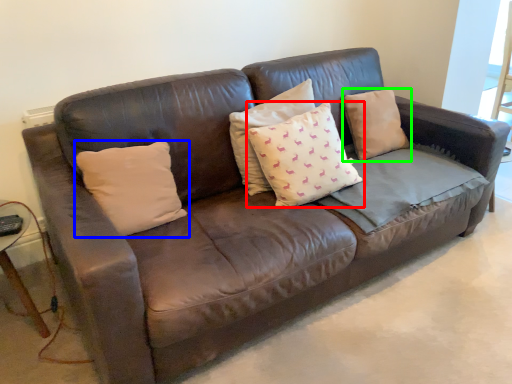
Question: Which is farther away from pillow (highlighted by a red box)? pillow (highlighted by a blue box) or pillow (highlighted by a green box)?

Choices:
 (A) pillow
 (B) pillow

Answer: (A)